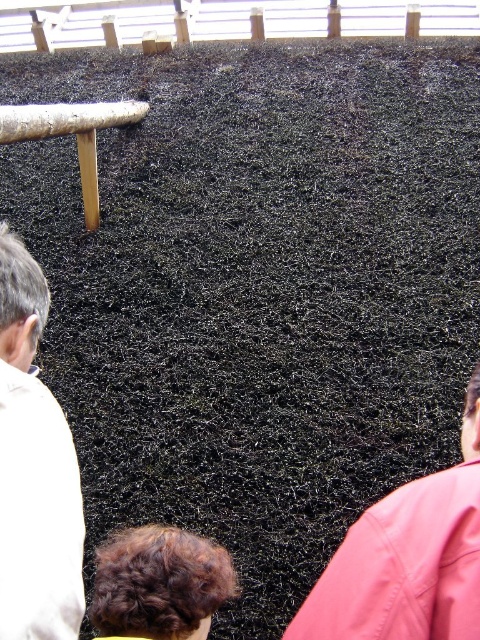
Question: Which of the following is the closest to the observer?

Choices:
 (A) (60, 440)
 (B) (387, 632)

Answer: (B)

Question: Is white fabric shirt at left positioned before brown curly hair at lower center?

Choices:
 (A) no
 (B) yes

Answer: (B)

Question: Which object is farther from the camera taking this photo?

Choices:
 (A) brown curly hair at lower center
 (B) pink fabric at lower right
 (C) white fabric shirt at left

Answer: (A)

Question: Which object is the farthest from the brown curly hair at lower center?

Choices:
 (A) white fabric shirt at left
 (B) pink fabric at lower right

Answer: (A)

Question: Is pink fabric at lower right wider than brown curly hair at lower center?

Choices:
 (A) yes
 (B) no

Answer: (A)

Question: Is white fabric shirt at left wider than brown curly hair at lower center?

Choices:
 (A) yes
 (B) no

Answer: (B)